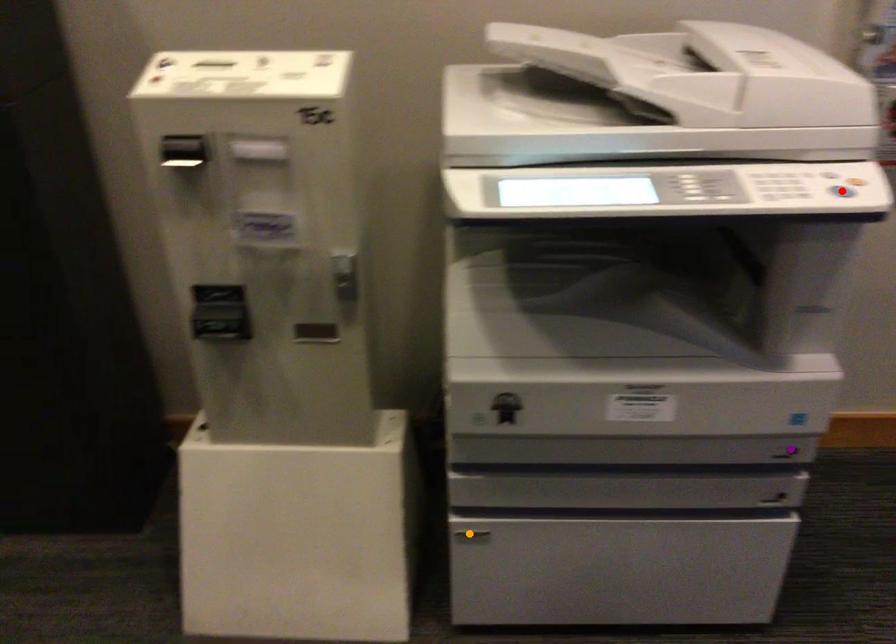
Order these from nearest to farthest:
purple point | orange point | red point

red point → purple point → orange point